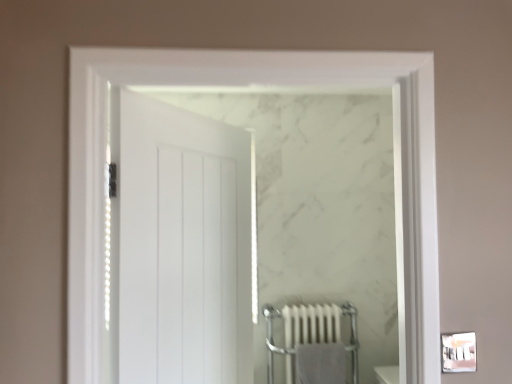
Question: Should I look upward or downward to see gray cotton bath towel at lower center?

Choices:
 (A) up
 (B) down

Answer: (B)

Question: Is white metallic radiator at lower center completely or partially inside white matte door at center?

Choices:
 (A) yes
 (B) no

Answer: (B)

Question: Is white matte door at center facing towards white metallic radiator at lower center?

Choices:
 (A) yes
 (B) no

Answer: (B)

Question: From the image's perspective, is white matte door at center on white metallic radiator at lower center?

Choices:
 (A) no
 (B) yes

Answer: (B)

Question: Does white matte door at center come behind white metallic radiator at lower center?

Choices:
 (A) yes
 (B) no

Answer: (B)

Question: Is white matte door at center looking in the opposite direction of white metallic radiator at lower center?

Choices:
 (A) yes
 (B) no

Answer: (B)

Question: Can you confirm if white matte door at center is thinner than white metallic radiator at lower center?

Choices:
 (A) no
 (B) yes

Answer: (B)

Question: Is gray cotton bath towel at lower center next to white metallic radiator at lower center and touching it?

Choices:
 (A) no
 (B) yes

Answer: (B)

Question: Can you confirm if gray cotton bath towel at lower center is taller than white metallic radiator at lower center?

Choices:
 (A) yes
 (B) no

Answer: (B)

Question: Is gray cotton bath towel at lower center completely or partially outside of white metallic radiator at lower center?

Choices:
 (A) no
 (B) yes

Answer: (A)

Question: From the image's perspective, is gray cotton bath towel at lower center above white metallic radiator at lower center?

Choices:
 (A) no
 (B) yes

Answer: (A)

Question: From the image's perspective, is gray cotton bath towel at lower center beneath white metallic radiator at lower center?

Choices:
 (A) yes
 (B) no

Answer: (A)

Question: Is gray cotton bath towel at lower center positioned before white metallic radiator at lower center?

Choices:
 (A) yes
 (B) no

Answer: (A)

Question: Does white metallic radiator at lower center have a lesser height compared to gray cotton bath towel at lower center?

Choices:
 (A) no
 (B) yes

Answer: (A)